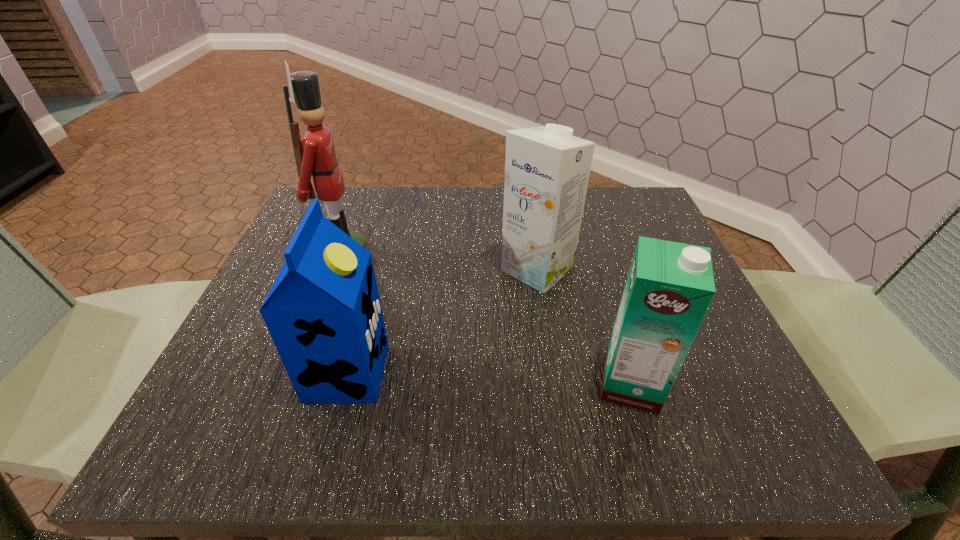
This screenshot has width=960, height=540. I want to click on object situated at the far left corner, so click(315, 156).

At what (x,y) coordinates should I click in order to perform the action: click on object located at the near left corner. Please return your answer as a coordinate pair (x, y). Image resolution: width=960 pixels, height=540 pixels. Looking at the image, I should click on (323, 312).

Locate an element on the screen. Image resolution: width=960 pixels, height=540 pixels. object at the near right corner is located at coordinates (670, 285).

Where is `blank space at the far edge of the desktop`? Image resolution: width=960 pixels, height=540 pixels. blank space at the far edge of the desktop is located at coordinates (428, 231).

In the image, there is a desktop. Where is `vacant region at the near edge`? The height and width of the screenshot is (540, 960). vacant region at the near edge is located at coordinates (528, 411).

Image resolution: width=960 pixels, height=540 pixels. Identify the location of vacant area at the left edge of the desktop. (234, 346).

In the image, there is a desktop. What are the coordinates of `vacant space at the right edge` in the screenshot? It's located at (617, 261).

This screenshot has height=540, width=960. I want to click on vacant space at the far left corner, so click(287, 239).

Locate an element on the screen. The width and height of the screenshot is (960, 540). free location at the far right corner of the desktop is located at coordinates (655, 211).

Where is `free space at the near right corner of the desktop`? free space at the near right corner of the desktop is located at coordinates (687, 413).